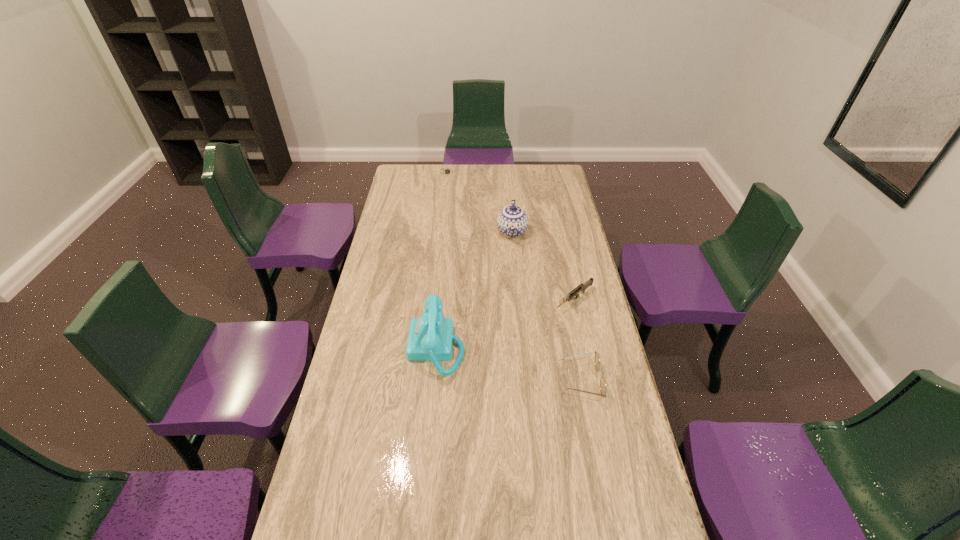
Locate an element on the screen. free space between the spectacles and the telephone is located at coordinates (509, 364).

The width and height of the screenshot is (960, 540). Identify the location of vacant space that is in between the watch and the third object from left to right. (480, 202).

Find the location of `free space that is in between the telephone and the spectacles`. free space that is in between the telephone and the spectacles is located at coordinates [x=509, y=364].

Image resolution: width=960 pixels, height=540 pixels. Find the location of `empty space that is in between the spectacles and the watch`. empty space that is in between the spectacles and the watch is located at coordinates (515, 276).

What are the coordinates of `blank region between the telephone and the gun` in the screenshot? It's located at (505, 323).

Locate an element on the screen. free area in between the spectacles and the second farthest object is located at coordinates (547, 306).

This screenshot has height=540, width=960. Identify the location of free spot between the spectacles and the telephone. (509, 364).

This screenshot has height=540, width=960. I want to click on free space that is in between the spectacles and the gun, so click(x=578, y=340).

Where is `empty space that is in between the farthest object and the spectacles`? The image size is (960, 540). empty space that is in between the farthest object and the spectacles is located at coordinates (515, 276).

In order to click on object that is the fourth closest to the shortest object in this screenshot , I will do `click(597, 359)`.